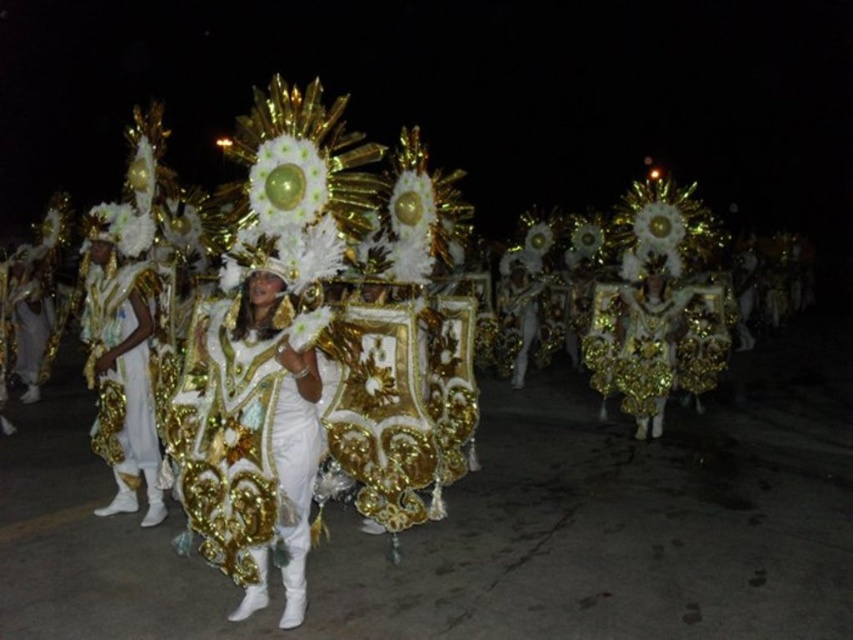
Question: Does white satin headdress at center have a lesser width compared to gold sequined costume at center?

Choices:
 (A) no
 (B) yes

Answer: (B)

Question: Which point is farther from the camera taking this photo?

Choices:
 (A) (669, 342)
 (B) (299, 502)

Answer: (A)

Question: Is white satin headdress at center further to the viewer compared to gold sequined costume at center?

Choices:
 (A) no
 (B) yes

Answer: (A)

Question: Does white satin costume at center appear under gold sequined costume at center?

Choices:
 (A) yes
 (B) no

Answer: (A)

Question: Which object is positioned closest to the white satin costume at center?

Choices:
 (A) gold sequined costume at center
 (B) white satin headdress at center

Answer: (B)

Question: Which object appears farthest from the camera in this image?

Choices:
 (A) white satin costume at center
 (B) white satin headdress at center
 (C) gold sequined costume at center

Answer: (C)